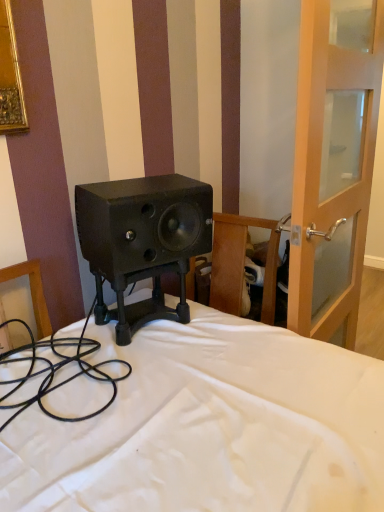
Find the location of `transparent glass door at right`. transparent glass door at right is located at coordinates (333, 170).

Identify the location of black rubber cable at lower left. This screenshot has height=512, width=384. (57, 370).

Between transparent glass door at right and black rubber cable at lower left, which one has smaller width?

With smaller width is transparent glass door at right.

Between transparent glass door at right and black rubber cable at lower left, which one is positioned in front?

black rubber cable at lower left.

In the scene shown: Could you tell me if transparent glass door at right is facing black rubber cable at lower left?

No.

How many degrees apart are the facing directions of black rubber cable at lower left and transparent glass door at right?

The angle between the facing direction of black rubber cable at lower left and the facing direction of transparent glass door at right is 5.16 degrees.

From the image's perspective, is black rubber cable at lower left below transparent glass door at right?

Yes, from the image's perspective, black rubber cable at lower left is beneath transparent glass door at right.

Is black rubber cable at lower left positioned with its back to transparent glass door at right?

No.

Between black rubber cable at lower left and transparent glass door at right, which one is positioned behind?

transparent glass door at right is more distant.

This screenshot has width=384, height=512. I want to click on cable that appears below the black matte speaker at center (from the image's perspective), so click(x=57, y=370).

Is black rubber cable at lower left positioned with its back to black matte speaker at center?

black rubber cable at lower left does not have its back to black matte speaker at center.

From the image's perspective, relative to black matte speaker at center, is black rubber cable at lower left above or below?

black rubber cable at lower left is below black matte speaker at center.

Is black rubber cable at lower left taller than black matte speaker at center?

Yes.

Which object is positioned more to the right, black matte speaker at center or transparent glass door at right?

From the viewer's perspective, transparent glass door at right appears more on the right side.

From the image's perspective, would you say black matte speaker at center is shown under transparent glass door at right?

Indeed, from the image's perspective, black matte speaker at center is shown beneath transparent glass door at right.

Looking at their sizes, would you say black matte speaker at center is wider or thinner than transparent glass door at right?

black matte speaker at center is wider than transparent glass door at right.

Considering the points (344, 177) and (114, 290), which point is behind, point (344, 177) or point (114, 290)?

The point (344, 177) is farther from the camera.

Based on the photo, which of these two, transparent glass door at right or black matte speaker at center, is smaller?

With smaller size is black matte speaker at center.

Locate an element on the screen. The image size is (384, 512). loudspeaker behind the transparent glass door at right is located at coordinates (142, 241).

Is black matte speaker at center in front of black rubber cable at lower left?

No, the depth of black matte speaker at center is greater than that of black rubber cable at lower left.

Can you confirm if black matte speaker at center is taller than black rubber cable at lower left?

Incorrect, the height of black matte speaker at center is not larger of that of black rubber cable at lower left.

Considering the relative sizes of black matte speaker at center and black rubber cable at lower left in the image provided, is black matte speaker at center smaller than black rubber cable at lower left?

Yes.

Which object is wider, black matte speaker at center or black rubber cable at lower left?

With larger width is black rubber cable at lower left.

What are the coordinates of `cable in front of the transparent glass door at right` in the screenshot? It's located at (57, 370).

Identify the location of cable on the left side of transparent glass door at right. (57, 370).

Based on their spatial positions, is black matte speaker at center or black rubber cable at lower left further from transparent glass door at right?

black rubber cable at lower left lies further to transparent glass door at right than the other object.

When comparing their distances from black rubber cable at lower left, does black matte speaker at center or transparent glass door at right seem further?

transparent glass door at right is further to black rubber cable at lower left.

In the scene shown: Considering their positions, is black rubber cable at lower left positioned further to transparent glass door at right than black matte speaker at center?

Among the two, black rubber cable at lower left is located further to transparent glass door at right.

Looking at the image, which one is located further to black matte speaker at center, transparent glass door at right or black rubber cable at lower left?

transparent glass door at right is positioned further to the anchor black matte speaker at center.

Looking at the image, which one is located further to black matte speaker at center, black rubber cable at lower left or transparent glass door at right?

The object further to black matte speaker at center is transparent glass door at right.

Looking at this image, when comparing their distances from black rubber cable at lower left, does transparent glass door at right or black matte speaker at center seem further?

The object further to black rubber cable at lower left is transparent glass door at right.

I want to click on loudspeaker between black rubber cable at lower left and transparent glass door at right, so click(x=142, y=241).